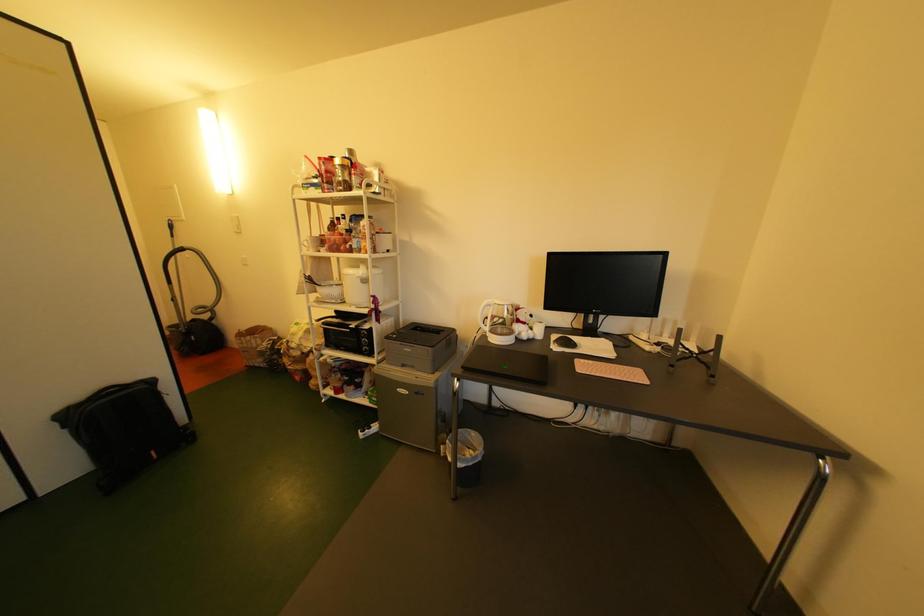
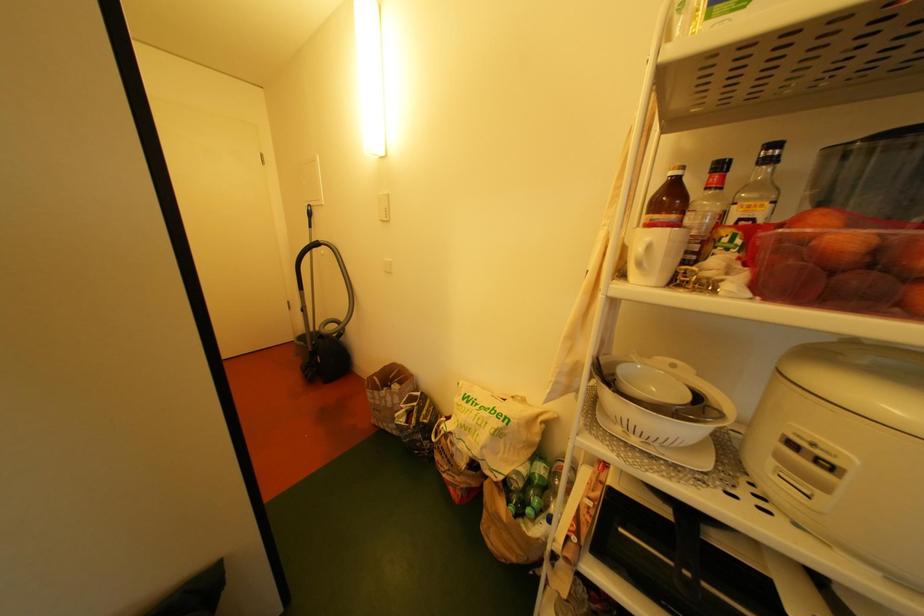
What movement of the cameraman would produce the second image?

The cameraman walked toward left, forward.